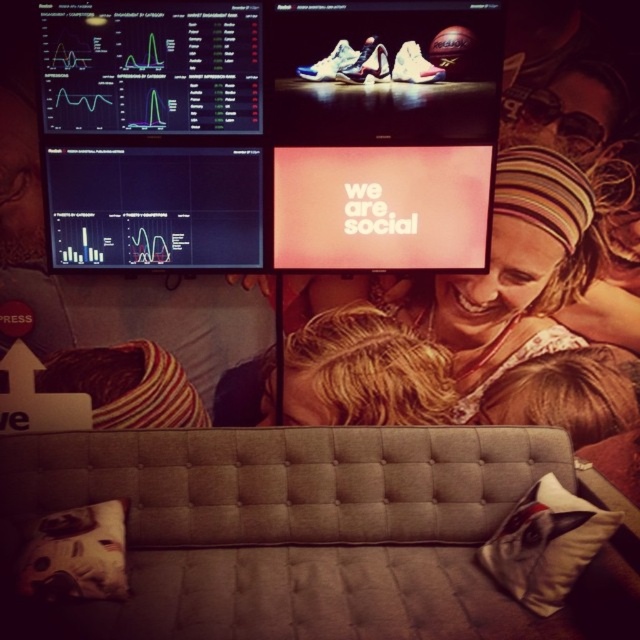
You are a delivery person who needs to place a small package between the matte plastic screen at upper center and the white fabric pillow at lower left. The package is 1.5 meters long. Can you fit it between them without moving either object?

The distance between the matte plastic screen at upper center and the white fabric pillow at lower left is only 1.27 meters, which is shorter than the 1.5 meter length of the package. Therefore, the package cannot fit between them without moving either object.

You are standing in the room and see two points marked on the wall above the sofa. The first point is at coordinates point (570, 547) and the second is at point (97, 556). Which point is closer to you?

Point (570, 547) is in front of point (97, 556), so the first point is closer to you.

You are a furniture designer who wants to place a new lamp on the tufted fabric couch at lower center. The lamp requires a surface that is higher than the couch. Can the matte pink headband at center provide a suitable surface for the lamp?

The tufted fabric couch at lower center has a lesser height compared to the matte pink headband at center. Therefore, the matte pink headband at center is taller and can provide a suitable surface for the lamp since it is higher than the couch.